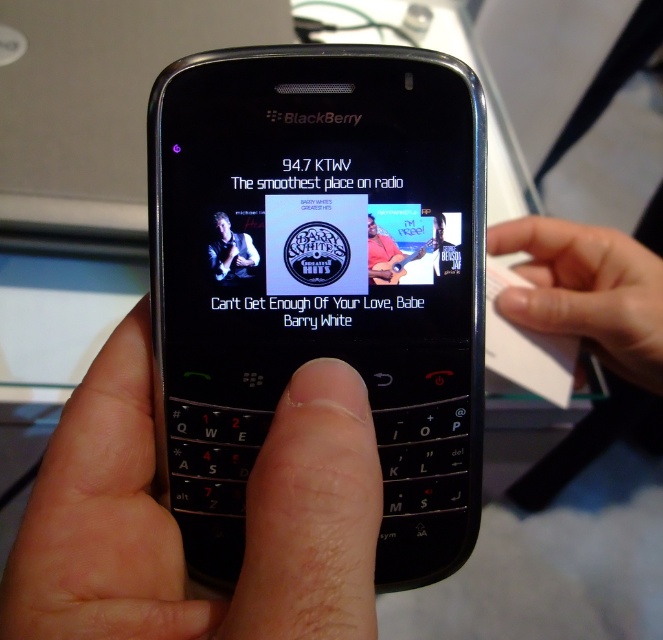
You are a graphic designer working on a project and need to place a small logo on the BlackBerry screen. The logo must be placed exactly at the point with coordinates point (176, 525). Where on the BlackBerry screen should you position the logo?

The point (176, 525) is located on the skinny white finger at center, so you should position the logo on the skinny white finger at center.

You are a photographer taking a picture of the BlackBerry smartphone. You notice the skinny white finger at center and the black leather jacket at upper center in your frame. Which object should you adjust to ensure the BlackBerry is centered in your shot?

You should adjust the black leather jacket at upper center because the skinny white finger at center is to the right of it, meaning the jacket is closer to the center and might be blocking the BlackBerry.

You are a photographer taking a picture of the BlackBerry smartphone. You notice the skinny white finger at center and the black leather jacket at upper center in the frame. Which object should you adjust to ensure both are visible in the photo?

You should adjust the black leather jacket at upper center because the skinny white finger at center is below it, so moving the jacket down or the finger up would ensure both are visible in the photo.